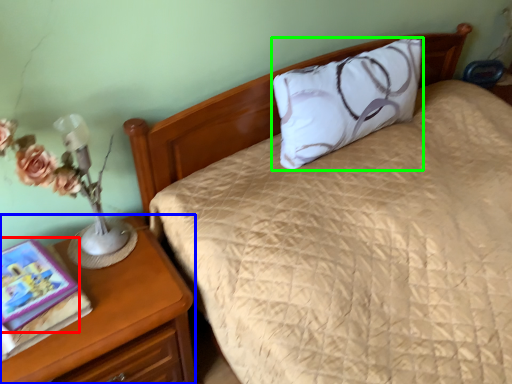
Question: Estimate the real-world distances between objects in this image. Which object is closer to book (highlighted by a red box), nightstand (highlighted by a blue box) or pillow (highlighted by a green box)?

Choices:
 (A) nightstand
 (B) pillow

Answer: (A)